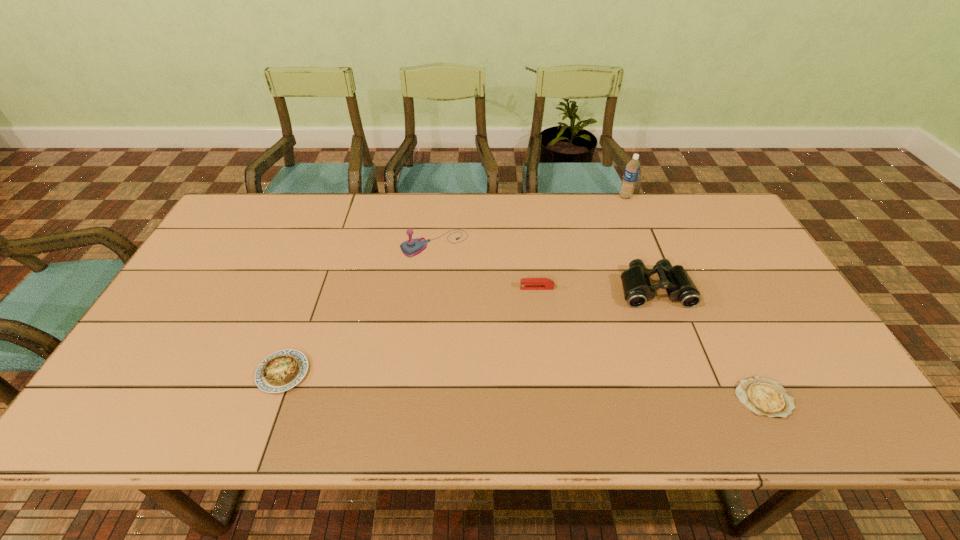
Locate an element on the screen. Image resolution: width=960 pixels, height=540 pixels. the second closest object to the tallest object is located at coordinates (526, 283).

Locate an element on the screen. free region that satisfies the following two spatial constraints: 1. on the back side of the farthest object; 2. on the left side of the second farthest object is located at coordinates (440, 197).